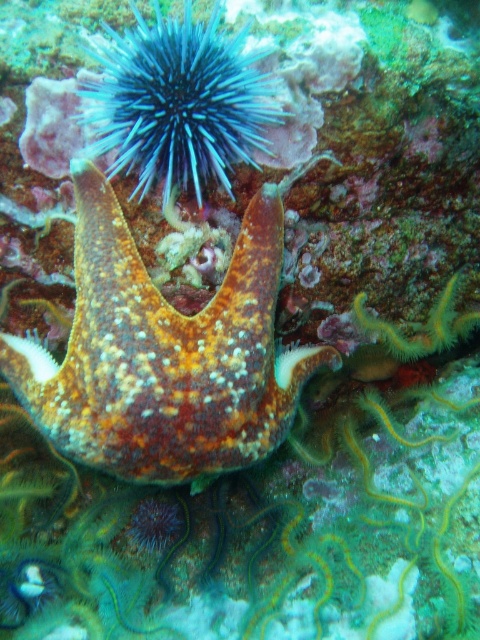
Question: From the image, what is the correct spatial relationship of rusty textured starfish at center in relation to blue spiny sea urchin at upper center?

Choices:
 (A) below
 (B) above

Answer: (A)

Question: Can you confirm if rusty textured starfish at center is wider than blue spiny sea urchin at upper center?

Choices:
 (A) no
 (B) yes

Answer: (B)

Question: Does rusty textured starfish at center have a smaller size compared to blue spiny sea urchin at upper center?

Choices:
 (A) yes
 (B) no

Answer: (B)

Question: Among these objects, which one is farthest from the camera?

Choices:
 (A) rusty textured starfish at center
 (B) blue spiny sea urchin at upper center

Answer: (A)